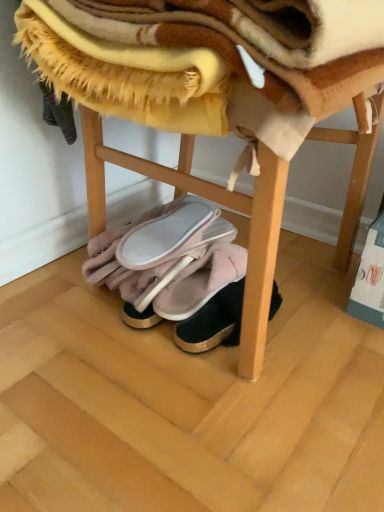
Question: Is the position of pink fluffy slippers at lower center, the fourth footwear positioned from the right, more distant than that of wooden stool at lower center?

Choices:
 (A) yes
 (B) no

Answer: (A)

Question: From a real-world perspective, does pink fluffy slippers at lower center, the fourth footwear positioned from the right, sit lower than wooden stool at lower center?

Choices:
 (A) yes
 (B) no

Answer: (A)

Question: Can you confirm if pink fluffy slippers at lower center, the fourth footwear positioned from the right, is positioned to the left of wooden stool at lower center?

Choices:
 (A) no
 (B) yes

Answer: (B)

Question: Does pink fluffy slippers at lower center, the first footwear viewed from the left, have a greater width compared to wooden stool at lower center?

Choices:
 (A) yes
 (B) no

Answer: (B)

Question: Does pink fluffy slippers at lower center, the fourth footwear positioned from the right, appear on the right side of wooden stool at lower center?

Choices:
 (A) no
 (B) yes

Answer: (A)

Question: In terms of width, does pink suede slippers at lower center, the 2th footwear when ordered from right to left, look wider or thinner when compared to velvet pink slippers at center, which is counted as the 1th footwear, starting from the right?

Choices:
 (A) wide
 (B) thin

Answer: (B)

Question: Choose the correct answer: Is pink suede slippers at lower center, the 2th footwear when ordered from right to left, inside velvet pink slippers at center, arranged as the 4th footwear when viewed from the left, or outside it?

Choices:
 (A) inside
 (B) outside

Answer: (B)

Question: Is pink suede slippers at lower center, the 2th footwear when ordered from right to left, bigger or smaller than velvet pink slippers at center, which is counted as the 1th footwear, starting from the right?

Choices:
 (A) small
 (B) big

Answer: (B)

Question: Is pink suede slippers at lower center, acting as the 3th footwear starting from the left, to the left or to the right of velvet pink slippers at center, which is counted as the 1th footwear, starting from the right, in the image?

Choices:
 (A) right
 (B) left

Answer: (B)

Question: Looking at their shapes, would you say fuzzy yellow blanket at upper center is wider or thinner than pink suede slippers at lower center, acting as the 3th footwear starting from the left?

Choices:
 (A) wide
 (B) thin

Answer: (A)

Question: From their relative heights in the image, would you say fuzzy yellow blanket at upper center is taller or shorter than pink suede slippers at lower center, the 2th footwear when ordered from right to left?

Choices:
 (A) tall
 (B) short

Answer: (A)

Question: Considering their positions, is fuzzy yellow blanket at upper center located in front of or behind pink suede slippers at lower center, the 2th footwear when ordered from right to left?

Choices:
 (A) front
 (B) behind

Answer: (A)

Question: From the image's perspective, relative to pink suede slippers at lower center, the 2th footwear when ordered from right to left, is fuzzy yellow blanket at upper center above or below?

Choices:
 (A) above
 (B) below

Answer: (A)

Question: Would you say velvet pink slippers at center, arranged as the 4th footwear when viewed from the left, is inside or outside pink fluffy slippers at lower center, the first footwear viewed from the left?

Choices:
 (A) outside
 (B) inside

Answer: (A)

Question: Based on their sizes in the image, would you say velvet pink slippers at center, arranged as the 4th footwear when viewed from the left, is bigger or smaller than pink fluffy slippers at lower center, the fourth footwear positioned from the right?

Choices:
 (A) big
 (B) small

Answer: (B)